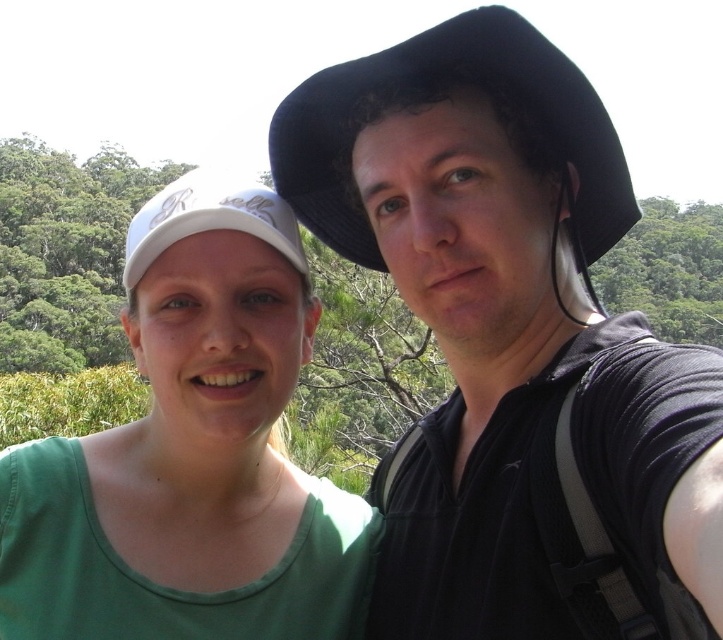
Question: Among these objects, which one is nearest to the camera?

Choices:
 (A) black fabric cowboy hat at upper center
 (B) white matte cap at center

Answer: (A)

Question: Can you confirm if black fabric cowboy hat at upper center is thinner than white matte cap at center?

Choices:
 (A) no
 (B) yes

Answer: (B)

Question: Which object appears farthest from the camera in this image?

Choices:
 (A) black fabric cowboy hat at upper center
 (B) green fabric shirt at left

Answer: (B)

Question: Is green fabric shirt at left behind white matte cap at center?

Choices:
 (A) yes
 (B) no

Answer: (A)

Question: Is black fabric cowboy hat at upper center above white matte cap at center?

Choices:
 (A) yes
 (B) no

Answer: (A)

Question: Estimate the real-world distances between objects in this image. Which object is farther from the matte black hat at upper center?

Choices:
 (A) green fabric shirt at left
 (B) black fabric cowboy hat at upper center
 (C) white matte cap at center

Answer: (C)